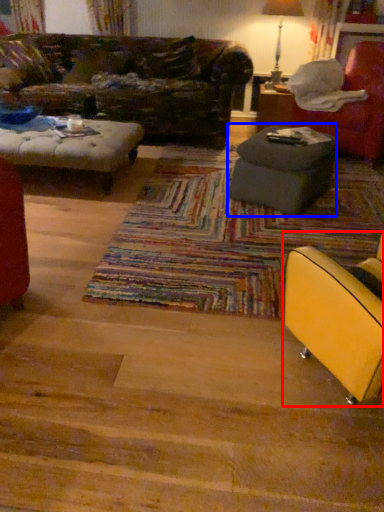
Question: Which point is further to the camera, chair (highlighted by a red box) or table (highlighted by a blue box)?

Choices:
 (A) chair
 (B) table

Answer: (B)